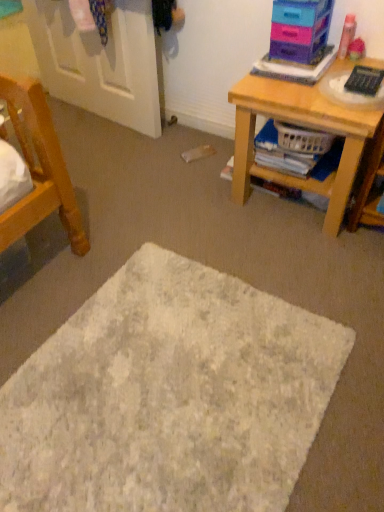
Question: From the image's perspective, is wooden desk at right located beneath white textured mat at center?

Choices:
 (A) no
 (B) yes

Answer: (A)

Question: Considering the relative positions of wooden desk at right and white textured mat at center in the image provided, is wooden desk at right in front of white textured mat at center?

Choices:
 (A) no
 (B) yes

Answer: (A)

Question: Considering the relative sizes of wooden desk at right and white textured mat at center in the image provided, is wooden desk at right bigger than white textured mat at center?

Choices:
 (A) no
 (B) yes

Answer: (B)

Question: Considering the relative positions of wooden desk at right and white textured mat at center in the image provided, is wooden desk at right to the left of white textured mat at center from the viewer's perspective?

Choices:
 (A) yes
 (B) no

Answer: (B)

Question: From a real-world perspective, is wooden desk at right over white textured mat at center?

Choices:
 (A) no
 (B) yes

Answer: (B)

Question: Is plastic basket at lower right situated inside white textured mat at center or outside?

Choices:
 (A) outside
 (B) inside

Answer: (A)

Question: Considering their positions, is plastic basket at lower right located in front of or behind white textured mat at center?

Choices:
 (A) front
 (B) behind

Answer: (B)

Question: Considering the positions of plastic basket at lower right and white textured mat at center in the image, is plastic basket at lower right wider or thinner than white textured mat at center?

Choices:
 (A) thin
 (B) wide

Answer: (A)

Question: In the image, is plastic basket at lower right on the left side or the right side of white textured mat at center?

Choices:
 (A) right
 (B) left

Answer: (A)

Question: Do you think white painted wood door at upper left is within white textured mat at center, or outside of it?

Choices:
 (A) inside
 (B) outside

Answer: (B)

Question: In terms of height, does white painted wood door at upper left look taller or shorter compared to white textured mat at center?

Choices:
 (A) short
 (B) tall

Answer: (B)

Question: Based on their sizes in the image, would you say white painted wood door at upper left is bigger or smaller than white textured mat at center?

Choices:
 (A) big
 (B) small

Answer: (A)

Question: In the image, is white painted wood door at upper left positioned in front of or behind white textured mat at center?

Choices:
 (A) behind
 (B) front

Answer: (A)

Question: Based on their sizes in the image, would you say white painted wood door at upper left is bigger or smaller than plastic storage drawers at upper right?

Choices:
 (A) small
 (B) big

Answer: (B)

Question: Which is correct: white painted wood door at upper left is inside plastic storage drawers at upper right, or outside of it?

Choices:
 (A) outside
 (B) inside

Answer: (A)